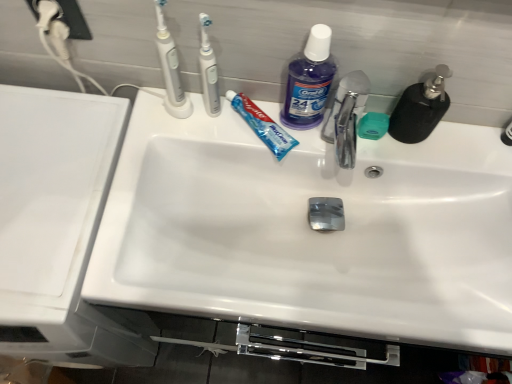
Identify the location of free location to the right of chrome metallic faucet at center. (435, 156).